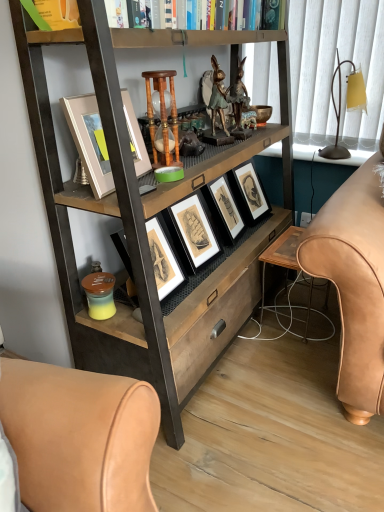
The height and width of the screenshot is (512, 384). In order to click on matte white picture frame at upper center, acting as the 1th picture frame starting from the front in this screenshot , I will do `click(90, 141)`.

Image resolution: width=384 pixels, height=512 pixels. What are the coordinates of `wooden bookcase at center` in the screenshot? It's located at (148, 215).

Measure the distance between point (x=193, y=20) and camera.

The distance of point (x=193, y=20) from camera is 3.89 feet.

What is the approximate width of hardcover books at upper center?

hardcover books at upper center is 27.77 centimeters wide.

Identify the location of wooden hourglass at center. (163, 119).

Describe the element at coordinates (224, 209) in the screenshot. I see `sepia-toned paper picture frame at center, arranged as the first picture frame when viewed from the back` at that location.

At what (x,y) coordinates should I click in order to perform the action: click on wooden table at lower center. Please return your answer as a coordinate pair (x, y). Looking at the image, I should click on (x=281, y=254).

Is matte white picture frame at upper center, marked as the first picture frame in a left-to-right arrangement, wider or thinner than matte yellow glass table lamp at right?

matte white picture frame at upper center, marked as the first picture frame in a left-to-right arrangement, is thinner than matte yellow glass table lamp at right.

From the image's perspective, is matte white picture frame at upper center, acting as the 1th picture frame starting from the front, located above matte yellow glass table lamp at right?

No.

Can you confirm if matte white picture frame at upper center, marked as the first picture frame in a left-to-right arrangement, is bigger than matte yellow glass table lamp at right?

A: Actually, matte white picture frame at upper center, marked as the first picture frame in a left-to-right arrangement, might be smaller than matte yellow glass table lamp at right.

Measure the distance from wooden hourglass at center to matte white picture frame at upper center, acting as the 1th picture frame starting from the front.

They are 5.47 inches apart.

What are the coordinates of `bar stool above the matte white picture frame at upper center, marked as the first picture frame in a left-to-right arrangement (from the image's perspective)` in the screenshot? It's located at (163, 119).

What's the angular difference between wooden hourglass at center and matte white picture frame at upper center, arranged as the second picture frame when viewed from the right,'s facing directions?

8.49 degrees separate the facing orientations of wooden hourglass at center and matte white picture frame at upper center, arranged as the second picture frame when viewed from the right.

In the image, is wooden hourglass at center positioned in front of or behind matte white picture frame at upper center, the 2th picture frame positioned from the back?

wooden hourglass at center is behind matte white picture frame at upper center, the 2th picture frame positioned from the back.

How many degrees apart are the facing directions of matte white picture frame at upper center, the 2th picture frame positioned from the back, and green patinated metal rabbit at center?

There is a 36.5-degree angle between the facing directions of matte white picture frame at upper center, the 2th picture frame positioned from the back, and green patinated metal rabbit at center.

Does point (133, 155) come farther from viewer compared to point (217, 68)?

No, (133, 155) is in front of (217, 68).

Can you confirm if matte white picture frame at upper center, arranged as the second picture frame when viewed from the right, is positioned to the right of green patinated metal rabbit at center?

Incorrect, matte white picture frame at upper center, arranged as the second picture frame when viewed from the right, is not on the right side of green patinated metal rabbit at center.

Which of these two, matte white picture frame at upper center, the 2th picture frame positioned from the back, or green patinated metal rabbit at center, stands shorter?

With less height is matte white picture frame at upper center, the 2th picture frame positioned from the back.

From a real-world perspective, is wooden bookcase at center physically above green patinated metal rabbit at center?

Incorrect, from a real-world perspective, wooden bookcase at center is lower than green patinated metal rabbit at center.

Is wooden bookcase at center to the left or to the right of green patinated metal rabbit at center in the image?

Based on their positions, wooden bookcase at center is located to the left of green patinated metal rabbit at center.

Is wooden bookcase at center not within green patinated metal rabbit at center?

wooden bookcase at center is positioned outside green patinated metal rabbit at center.

Is matte yellow glass table lamp at right a part of wooden table at lower center?

No, matte yellow glass table lamp at right is not a part of wooden table at lower center.

Is wooden table at lower center wider than matte yellow glass table lamp at right?

Yes, wooden table at lower center is wider than matte yellow glass table lamp at right.

Who is taller, wooden table at lower center or matte yellow glass table lamp at right?

With more height is matte yellow glass table lamp at right.

Can you confirm if wooden table at lower center is smaller than matte yellow glass table lamp at right?

Actually, wooden table at lower center might be larger than matte yellow glass table lamp at right.

Is hardcover books at upper center behind matte yellow glass table lamp at right?

That is False.

Is hardcover books at upper center not near matte yellow glass table lamp at right?

No, hardcover books at upper center is not far from matte yellow glass table lamp at right.

Choose the correct answer: Is hardcover books at upper center inside matte yellow glass table lamp at right or outside it?

hardcover books at upper center is not enclosed by matte yellow glass table lamp at right.

Is hardcover books at upper center taller than matte yellow glass table lamp at right?

Incorrect, the height of hardcover books at upper center is not larger of that of matte yellow glass table lamp at right.

Can you confirm if green patinated metal rabbit at center is bigger than wooden hourglass at center?

Actually, green patinated metal rabbit at center might be smaller than wooden hourglass at center.

Which object is closer to the camera, green patinated metal rabbit at center or wooden hourglass at center?

wooden hourglass at center is more forward.

Is green patinated metal rabbit at center facing away from wooden hourglass at center?

No, green patinated metal rabbit at center is not facing away from wooden hourglass at center.

Do you think green patinated metal rabbit at center is within wooden hourglass at center, or outside of it?

green patinated metal rabbit at center is not inside wooden hourglass at center, it's outside.

This screenshot has height=512, width=384. I want to click on the 2nd picture frame to the left of the matte yellow glass table lamp at right, starting your count from the anchor, so tap(90, 141).

From the image's perspective, which picture frame is the 1st one below the wooden hourglass at center? Please provide its 2D coordinates.

[(90, 141)]

Which object lies further to the anchor point matte white picture frame at upper center, the 2th picture frame positioned from the back, matte yellow glass table lamp at right or sepia-toned paper picture frame at center, which is counted as the second picture frame, starting from the left?

matte yellow glass table lamp at right is positioned further to the anchor matte white picture frame at upper center, the 2th picture frame positioned from the back.

Looking at the image, which one is located closer to wooden table at lower center, hardcover books at upper center or sepia-toned paper picture frame at center, which is counted as the second picture frame, starting from the left?

Among the two, sepia-toned paper picture frame at center, which is counted as the second picture frame, starting from the left, is located nearer to wooden table at lower center.

Estimate the real-world distances between objects in this image. Which object is closer to matte white picture frame at upper center, marked as the first picture frame in a left-to-right arrangement, wooden bookcase at center or sepia-toned paper picture frame at center, acting as the 1th picture frame starting from the right?

wooden bookcase at center is positioned closer to the anchor matte white picture frame at upper center, marked as the first picture frame in a left-to-right arrangement.

Estimate the real-world distances between objects in this image. Which object is further from wooden table at lower center, green patinated metal rabbit at center or hardcover books at upper center?

Among the two, hardcover books at upper center is located further to wooden table at lower center.

When comparing their distances from matte white picture frame at upper center, acting as the 1th picture frame starting from the front, does wooden table at lower center or wooden bookcase at center seem closer?

→ wooden bookcase at center is closer to matte white picture frame at upper center, acting as the 1th picture frame starting from the front.

When comparing their distances from wooden table at lower center, does hardcover books at upper center or green patinated metal rabbit at center seem further?

Based on the image, hardcover books at upper center appears to be further to wooden table at lower center.

Considering their positions, is matte white picture frame at upper center, marked as the first picture frame in a left-to-right arrangement, positioned closer to wooden hourglass at center than sepia-toned paper picture frame at center, which is counted as the second picture frame, starting from the left?

Based on the image, matte white picture frame at upper center, marked as the first picture frame in a left-to-right arrangement, appears to be nearer to wooden hourglass at center.

Looking at the image, which one is located closer to wooden bookcase at center, green patinated metal rabbit at center or wooden table at lower center?

wooden table at lower center.

Where is `bar stool between hardcover books at upper center and wooden bookcase at center in the up-down direction`? bar stool between hardcover books at upper center and wooden bookcase at center in the up-down direction is located at coordinates (163, 119).

Locate an element on the screen. bookcase between hardcover books at upper center and wooden table at lower center from top to bottom is located at coordinates (148, 215).

Locate an element on the screen. The width and height of the screenshot is (384, 512). animal between matte yellow glass table lamp at right and wooden table at lower center vertically is located at coordinates (218, 97).

Image resolution: width=384 pixels, height=512 pixels. I want to click on picture frame between matte white picture frame at upper center, marked as the first picture frame in a left-to-right arrangement, and wooden table at lower center, so click(x=224, y=209).